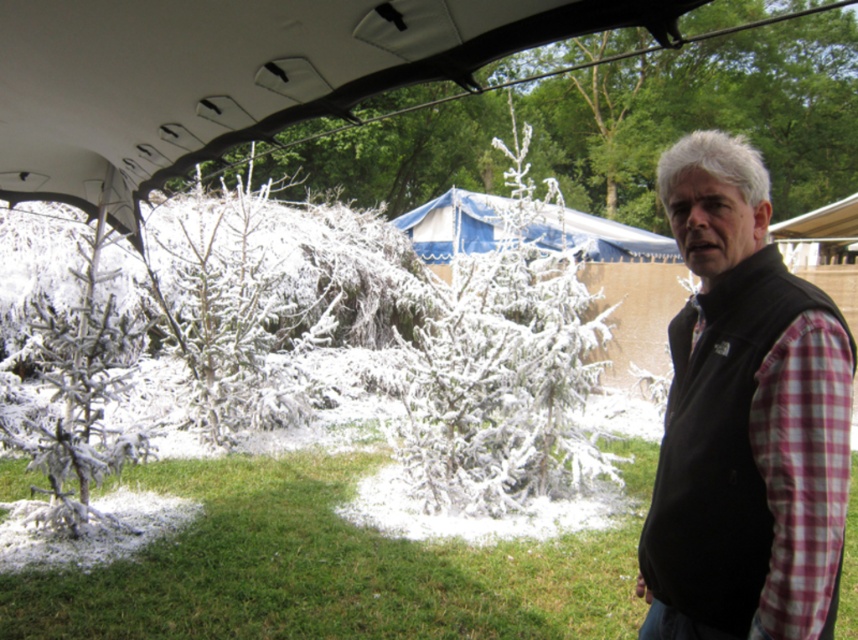
Based on the photo, does white matte canopy at upper center appear on the left side of white frosty branches at left?

Incorrect, white matte canopy at upper center is not on the left side of white frosty branches at left.

In the scene shown: Measure the distance from white matte canopy at upper center to white frosty branches at left.

4.99 feet

Does point (421, 8) lie behind point (79, 346)?

No.

This screenshot has height=640, width=858. I want to click on white matte canopy at upper center, so click(x=234, y=76).

In the scene shown: Can you confirm if white frosty branches at center is taller than blue fabric canopy at center?

No.

Which of these two, white frosty branches at center or blue fabric canopy at center, stands taller?

blue fabric canopy at center

The height and width of the screenshot is (640, 858). Describe the element at coordinates (505, 371) in the screenshot. I see `white frosty branches at center` at that location.

At what (x,y) coordinates should I click in order to perform the action: click on white frosty branches at center. Please return your answer as a coordinate pair (x, y). Image resolution: width=858 pixels, height=640 pixels. Looking at the image, I should click on (505, 371).

Is black fleece vest at right to the left of white frosty branches at left from the viewer's perspective?

Incorrect, black fleece vest at right is not on the left side of white frosty branches at left.

Who is positioned more to the right, black fleece vest at right or white frosty branches at left?

black fleece vest at right

Is point (653, 545) farther from viewer compared to point (73, 413)?

No.

Where is `black fleece vest at right`? The width and height of the screenshot is (858, 640). black fleece vest at right is located at coordinates (741, 417).